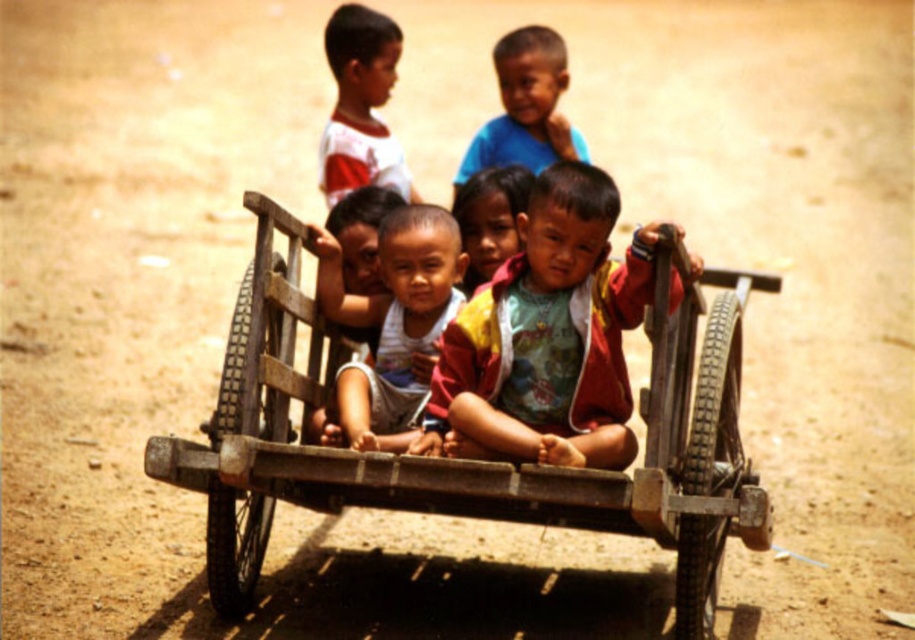
Looking at this image, you are a photographer standing at the edge of a field. You see a wooden cart with children sitting in it. There is a point marked at coordinates (547, 337). What object is located at that point?

The point at coordinates (547, 337) indicates the multicolored fabric shirt at center.

From the picture: You are standing at the back of the wooden cart and want to move to the front. Which point, point (x=571, y=220) or point (x=382, y=337), would you pass through first?

You would pass through point (x=571, y=220) first because it is in front of point (x=382, y=337).

You are a parent trying to decide if your child can sit comfortably in the wooden cart at center while wearing their white cotton shirt at upper left. Based on the cart and shirt sizes, will there be enough space?

The wooden cart at center has a lesser width compared to white cotton shirt at upper left, which means the cart is narrower than the shirt. Since the shirt is wider, it might not fit properly in the cart, so there may not be enough space for comfortable seating.